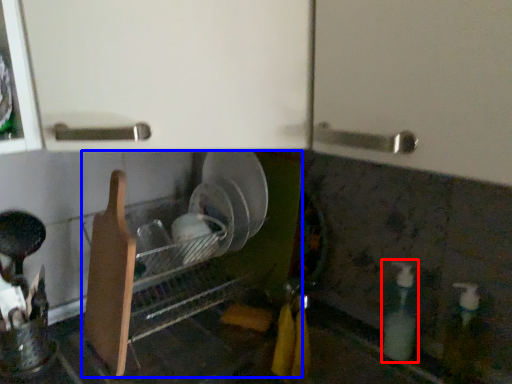
Question: Which point is further to the camera, bottle (highlighted by a red box) or dish washer (highlighted by a blue box)?

Choices:
 (A) bottle
 (B) dish washer

Answer: (A)